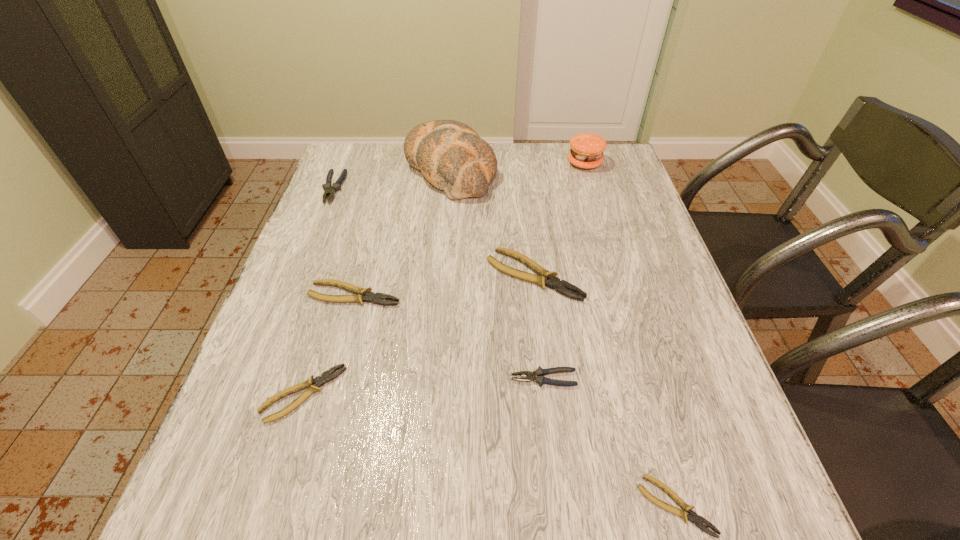
This screenshot has width=960, height=540. In order to click on vacant point located between the biggest yellow pliers and the third smallest yellow pliers in this screenshot , I will do `click(444, 285)`.

Image resolution: width=960 pixels, height=540 pixels. Identify the location of free space between the nearer gray pliers and the third smallest yellow pliers. (449, 336).

I want to click on empty space between the second yellow pliers from right to left and the tallest object, so click(x=492, y=222).

Identify the location of free area in between the smaller gray pliers and the farther gray pliers. (439, 284).

I want to click on free space between the nearer gray pliers and the biggest yellow pliers, so click(539, 327).

Where is `vacant area between the third yellow pliers from left to right and the third smallest yellow pliers`? The image size is (960, 540). vacant area between the third yellow pliers from left to right and the third smallest yellow pliers is located at coordinates (444, 285).

This screenshot has width=960, height=540. Find the location of `object that ranks as the second closest to the biggest yellow pliers`. object that ranks as the second closest to the biggest yellow pliers is located at coordinates (450, 154).

This screenshot has height=540, width=960. What are the coordinates of `the sixth closest object relative to the biggest yellow pliers` in the screenshot? It's located at (693, 517).

Where is `pliers object that ranks as the sixth closest to the bread`? pliers object that ranks as the sixth closest to the bread is located at coordinates (693, 517).

The width and height of the screenshot is (960, 540). In order to click on pliers that stands as the third closest to the farther gray pliers in this screenshot , I will do `click(319, 381)`.